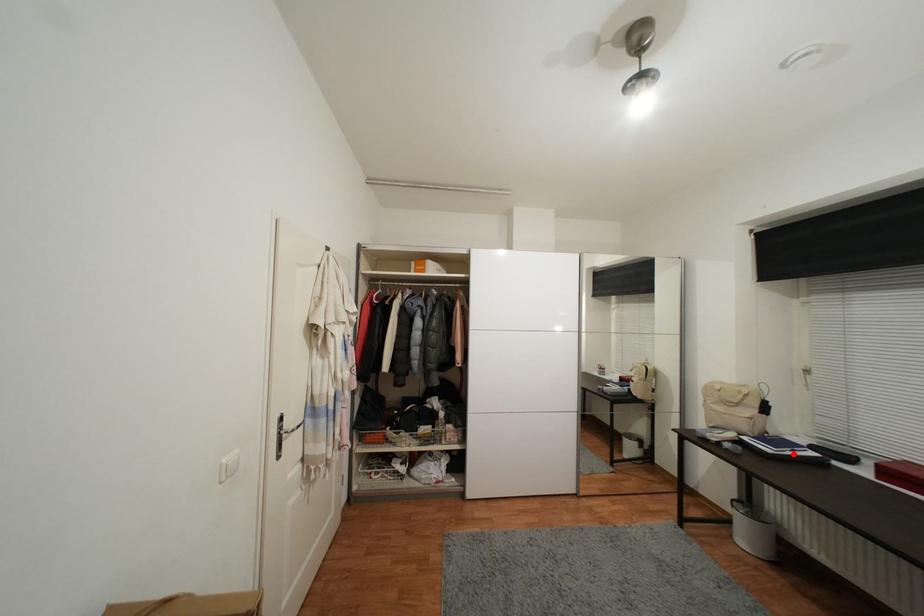
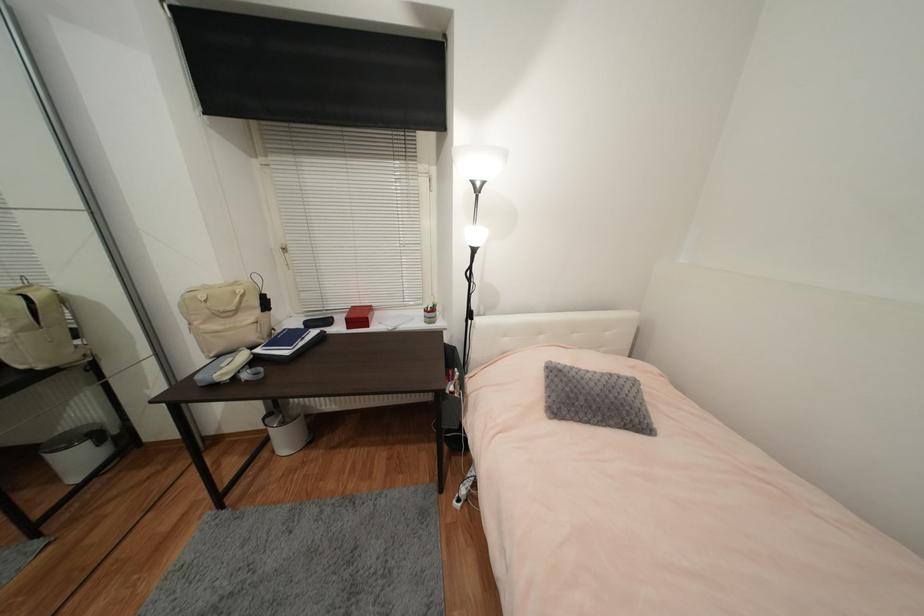
Find the pixel in the second image that matches the highlighted location in the first image.

(306, 344)